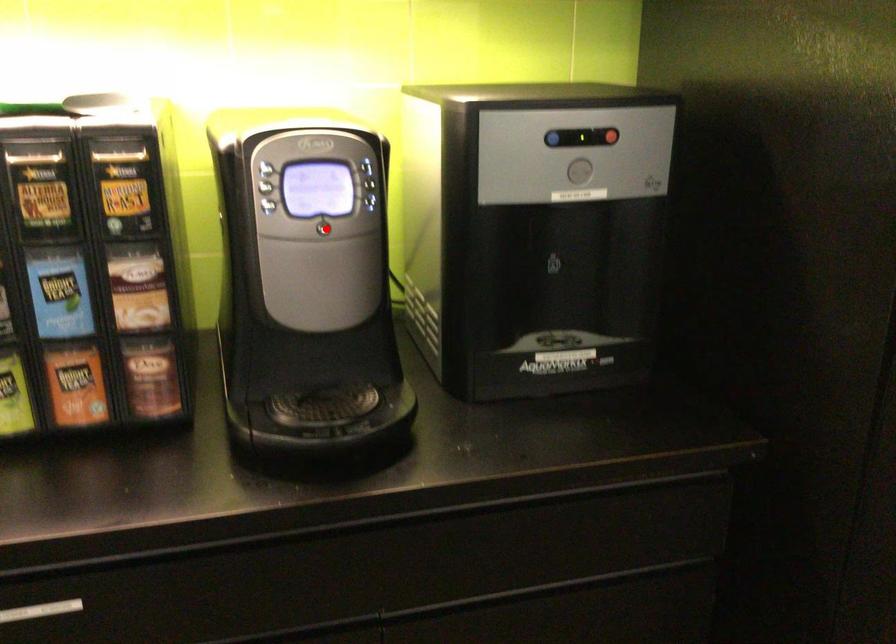
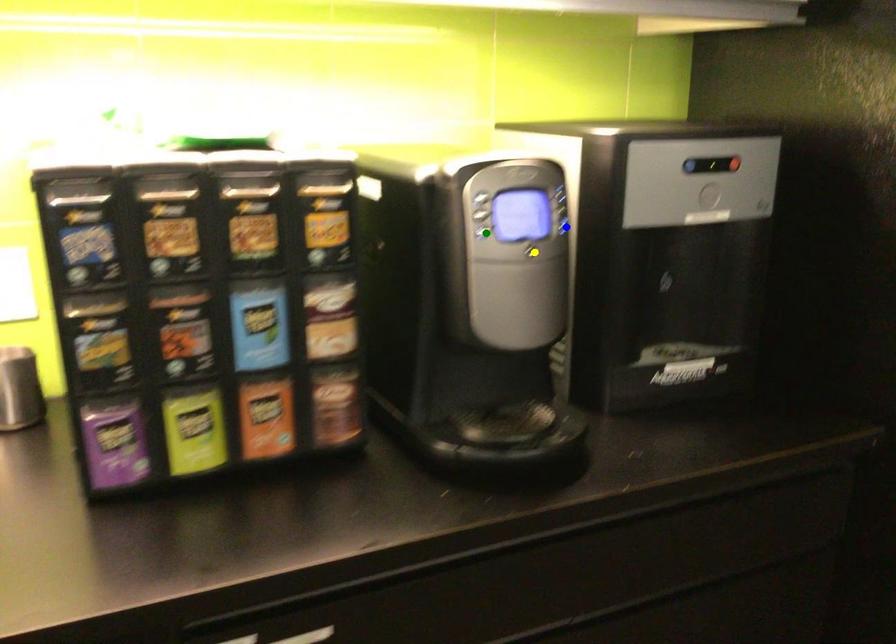
Question: I am providing you with two images of the same scene from different viewpoints. A red point is marked on the first image. You are given multiple points on the second image. Which point in image 2 represents the same 3d spot as the red point in image 1?

Choices:
 (A) green point
 (B) blue point
 (C) yellow point

Answer: (C)